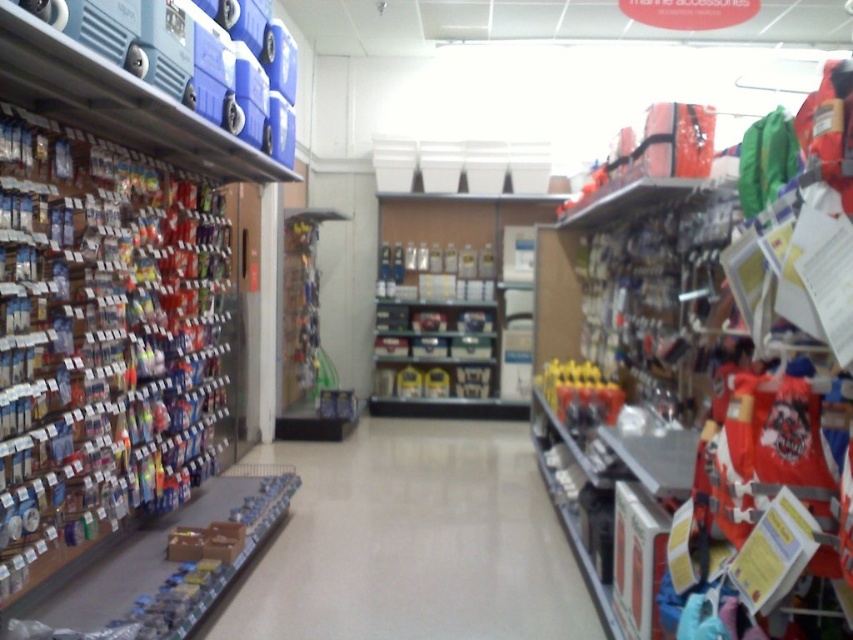
Can you confirm if white glossy floor at center is positioned to the right of metallic silver canisters at center?

In fact, white glossy floor at center is to the left of metallic silver canisters at center.

Does white glossy floor at center have a greater width compared to metallic silver canisters at center?

Indeed, white glossy floor at center has a greater width compared to metallic silver canisters at center.

Between point (364, 580) and point (563, 416), which one is positioned in front?

Positioned in front is point (364, 580).

You are a GUI agent. You are given a task and a screenshot of the screen. Output one action in this format:
    pyautogui.click(x=<x>, y=<y>)
    Task: Click on the white glossy floor at center
    Image resolution: width=853 pixels, height=640 pixels.
    Given the screenshot: What is the action you would take?
    coord(413,541)